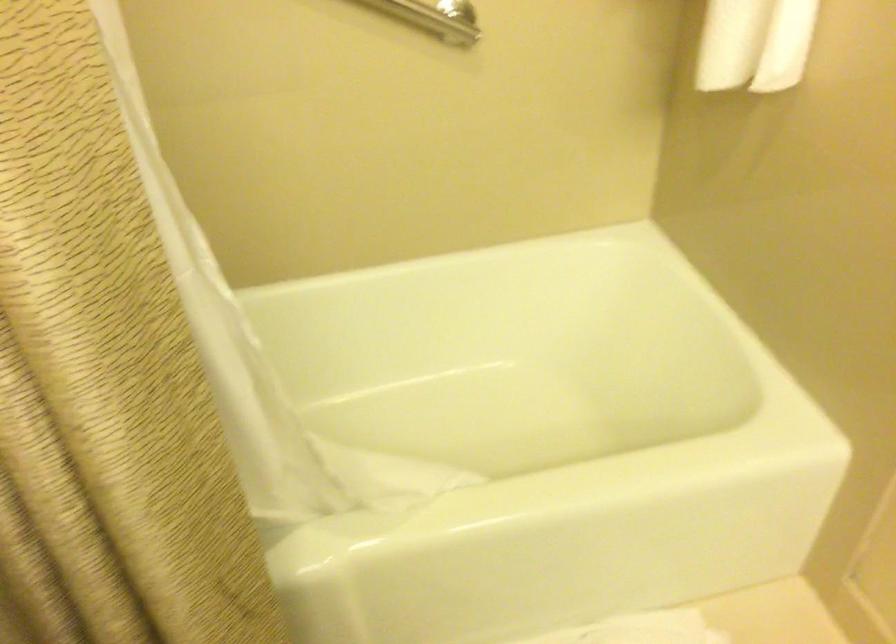
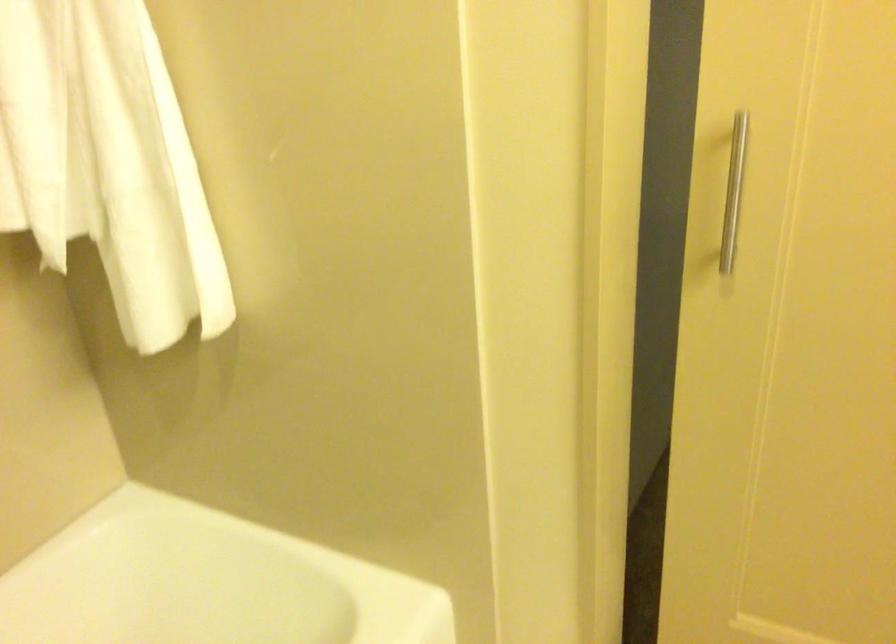
Question: The camera is either moving clockwise (left) or counter-clockwise (right) around the object. The first image is from the beginning of the video and the second image is from the end. Is the camera moving left or right when shooting the video?

Choices:
 (A) Left
 (B) Right

Answer: (A)